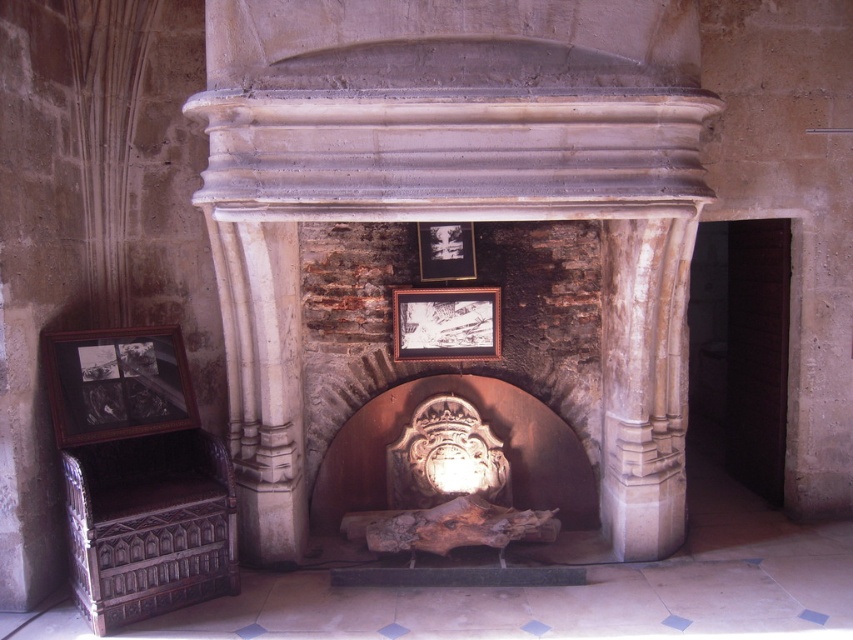
Does smooth stone fireplace at center have a smaller size compared to white stone column at center-left?

No.

Which is more to the right, smooth stone fireplace at center or white stone column at center-left?

smooth stone fireplace at center is more to the right.

The image size is (853, 640). I want to click on smooth stone fireplace at center, so click(x=456, y=200).

Does white stone column at center-left have a lesser height compared to black matte picture frame at center?

No, white stone column at center-left is not shorter than black matte picture frame at center.

Does white stone column at center-left have a lesser width compared to black matte picture frame at center?

Correct, white stone column at center-left's width is less than black matte picture frame at center's.

Who is more forward, (207, 212) or (460, 336)?

Point (207, 212) is in front.

Locate an element on the screen. The height and width of the screenshot is (640, 853). white stone column at center-left is located at coordinates (262, 381).

What do you see at coordinates (445, 323) in the screenshot? The height and width of the screenshot is (640, 853). I see `black matte picture frame at center` at bounding box center [445, 323].

Where is `black matte picture frame at center`? The image size is (853, 640). black matte picture frame at center is located at coordinates (445, 323).

The height and width of the screenshot is (640, 853). I want to click on black matte picture frame at center, so click(445, 323).